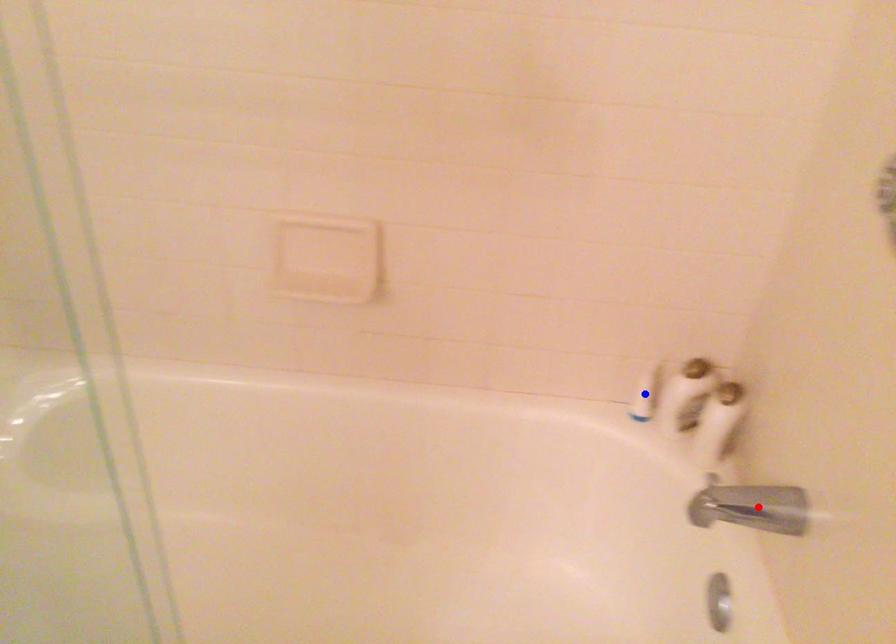
Question: In the image, two points are highlighted. Which point is nearer to the camera? Reply with the corresponding letter.

Choices:
 (A) blue point
 (B) red point

Answer: (B)